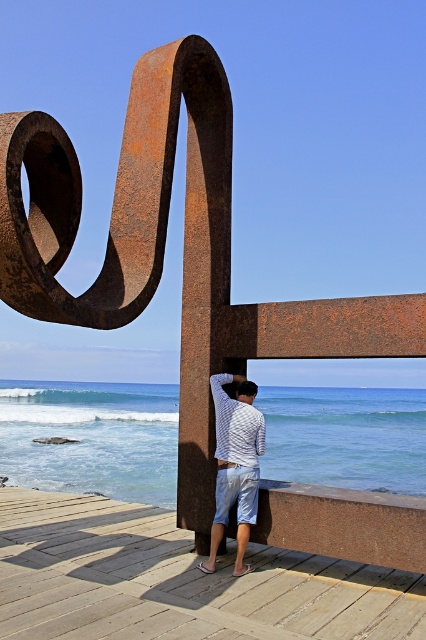
Question: Which of the following is the closest to the observer?

Choices:
 (A) (26, 589)
 (B) (267, 404)

Answer: (A)

Question: Among these objects, which one is nearest to the camera?

Choices:
 (A) rustic wood dock at lower center
 (B) blue water at lower center

Answer: (A)

Question: Can you confirm if blue water at lower center is smaller than white striped shirt at center?

Choices:
 (A) no
 (B) yes

Answer: (A)

Question: From the image, what is the correct spatial relationship of rustic wood dock at lower center in relation to white striped shirt at center?

Choices:
 (A) right
 (B) left

Answer: (A)

Question: From the image, what is the correct spatial relationship of blue water at lower center in relation to white striped shirt at center?

Choices:
 (A) above
 (B) below

Answer: (B)

Question: Among these objects, which one is farthest from the camera?

Choices:
 (A) rustic wood dock at lower center
 (B) white striped shirt at center
 (C) blue water at lower center

Answer: (C)